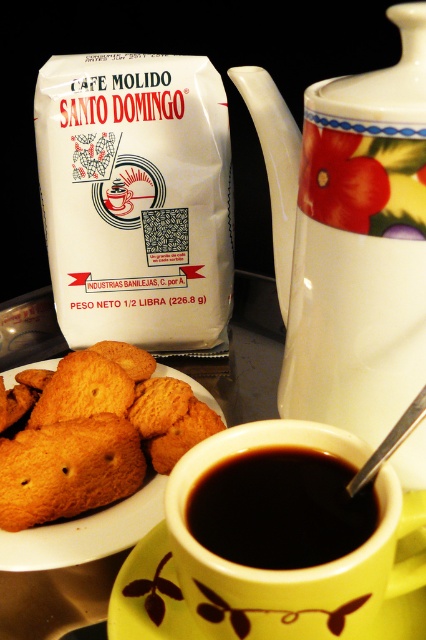
Based on the photo, you are planning to pack these items into a lunchbox that has a height limit of 10 cm. The golden crispy cookie at center and the black matte cup at center need to be placed inside. Based on their sizes, which item might not fit if placed upright?

The golden crispy cookie at center is larger in size than the black matte cup at center, so the golden crispy cookie at center might not fit in the lunchbox if placed upright due to its larger size.

You are setting up a small breakfast tray and need to arrange the golden crispy cookie at center and the black matte cup at center. If you want to place them side by side without overlapping, which one should you place first to ensure there is enough space?

The golden crispy cookie at center has a larger width than the black matte cup at center, so you should place the golden crispy cookie at center first to ensure there is enough space for both items when placing them side by side.